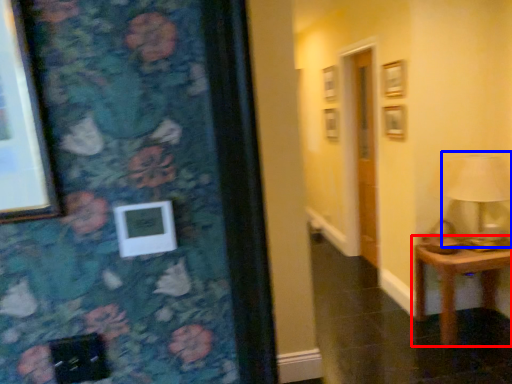
Question: Which object is further to the camera taking this photo, table (highlighted by a red box) or table lamp (highlighted by a blue box)?

Choices:
 (A) table
 (B) table lamp

Answer: (A)